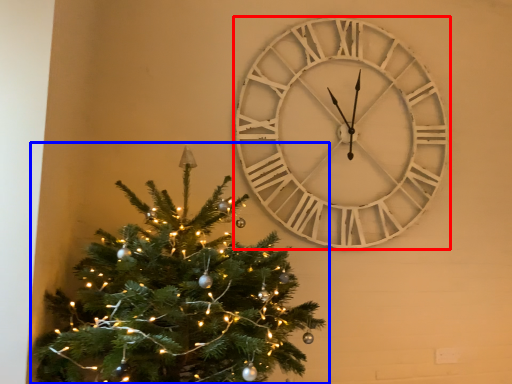
Question: Which of the following is the farthest to the observer, wall clock (highlighted by a red box) or christmas tree (highlighted by a blue box)?

Choices:
 (A) wall clock
 (B) christmas tree

Answer: (A)